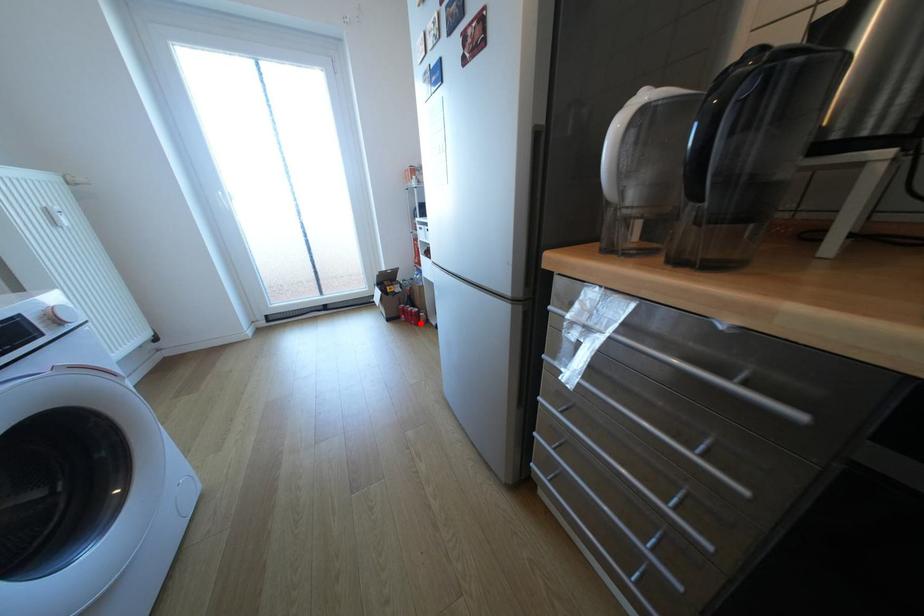
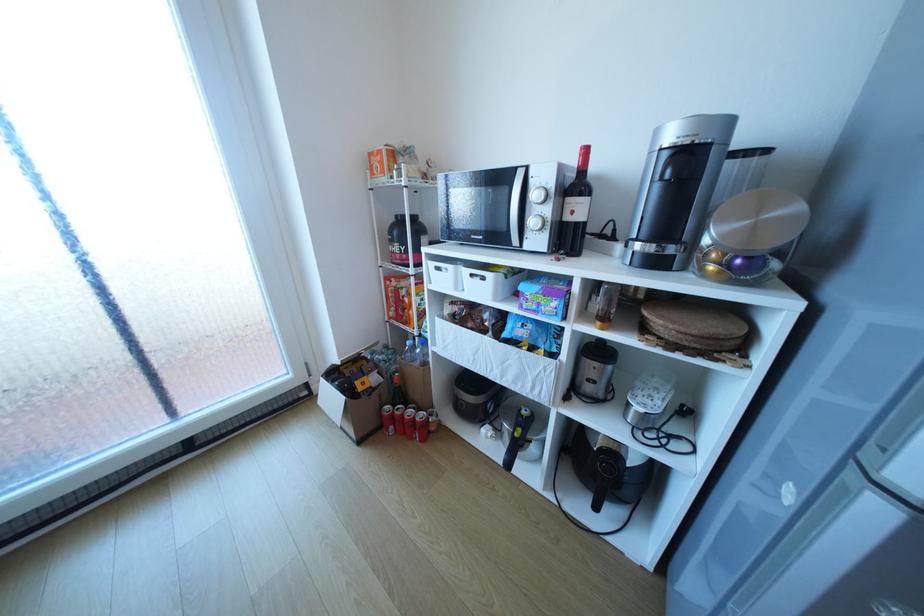
Question: I am providing you with two images of the same scene from different viewpoints. A red point is shown in image1. For the corresponding object point in image2, is it positioned nearer or farther from the camera?

Choices:
 (A) Nearer
 (B) Farther

Answer: (B)